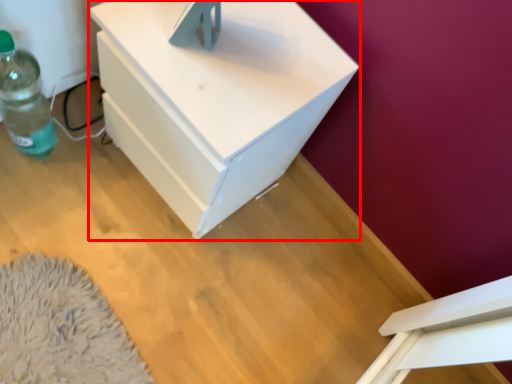
Question: From the image's perspective, where is nightstand (annotated by the red box) located relative to bottle?

Choices:
 (A) above
 (B) below

Answer: (B)